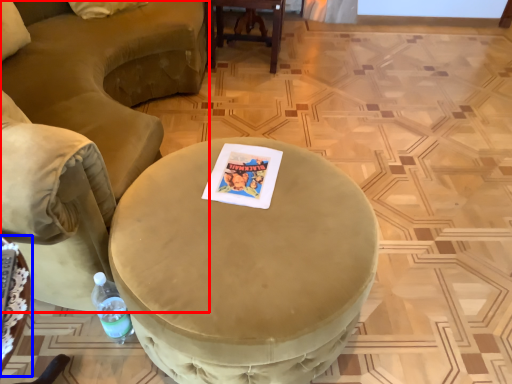
Question: Which of the following is the farthest to the observer, chair (highlighted by a red box) or table (highlighted by a blue box)?

Choices:
 (A) chair
 (B) table

Answer: (B)